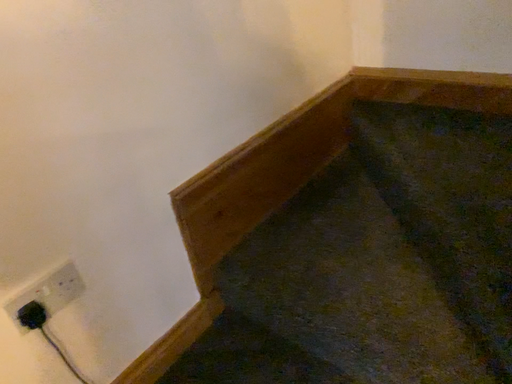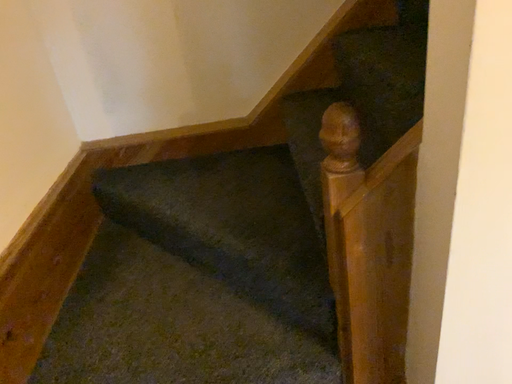
Question: Which way did the camera rotate in the video?

Choices:
 (A) rotated upward
 (B) rotated downward

Answer: (A)